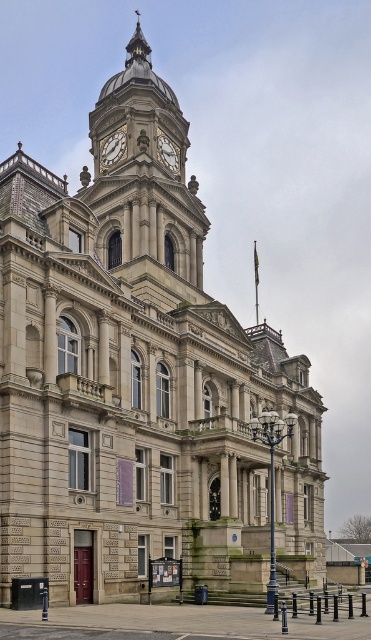
You are standing in front of the historic building and notice the matte gray clock at upper center. Where exactly is this clock positioned relative to the building?

The matte gray clock at upper center is located at point coordinates of 0.231 on the horizontal axis and 0.305 on the vertical axis relative to the building.

You are standing in front of the grand historic building and want to locate the golden stone clock tower at upper center. According to the coordinates provided, where exactly is it positioned?

The golden stone clock tower at upper center is located at coordinates point (x=143, y=172).